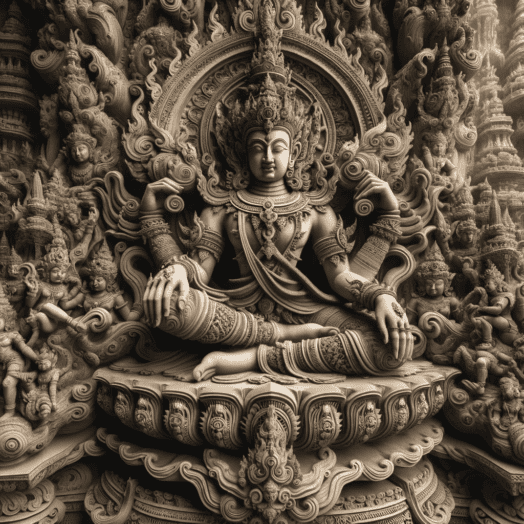
Where is `statue figure`? The height and width of the screenshot is (524, 524). statue figure is located at coordinates (242, 209).